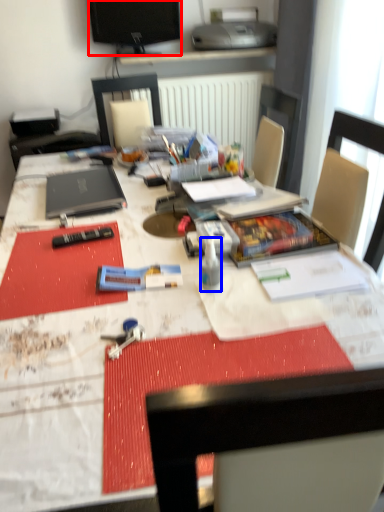
Question: Which object is further to the camera taking this photo, television (highlighted by a red box) or bottle (highlighted by a blue box)?

Choices:
 (A) television
 (B) bottle

Answer: (A)